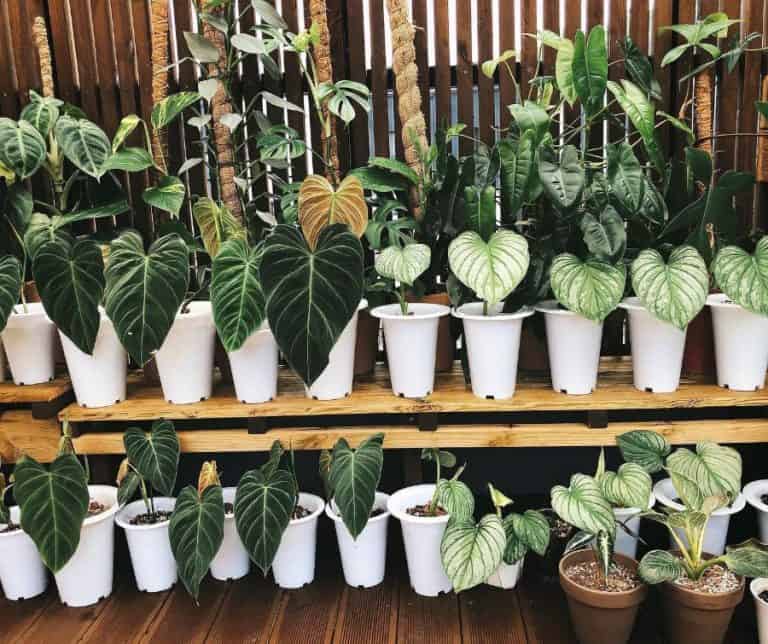
You are a GUI agent. You are given a task and a screenshot of the screen. Output one action in this format:
    pyautogui.click(x=<x>, y=<y>)
    Task: Click on the pot
    Image resolution: width=768 pixels, height=644 pixels.
    Given the screenshot: What is the action you would take?
    pyautogui.click(x=432, y=567)